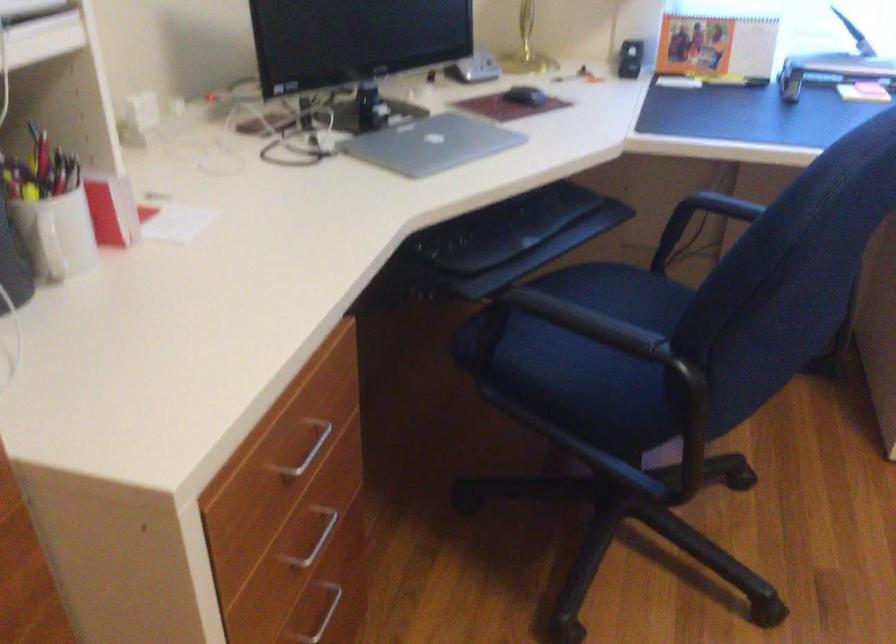
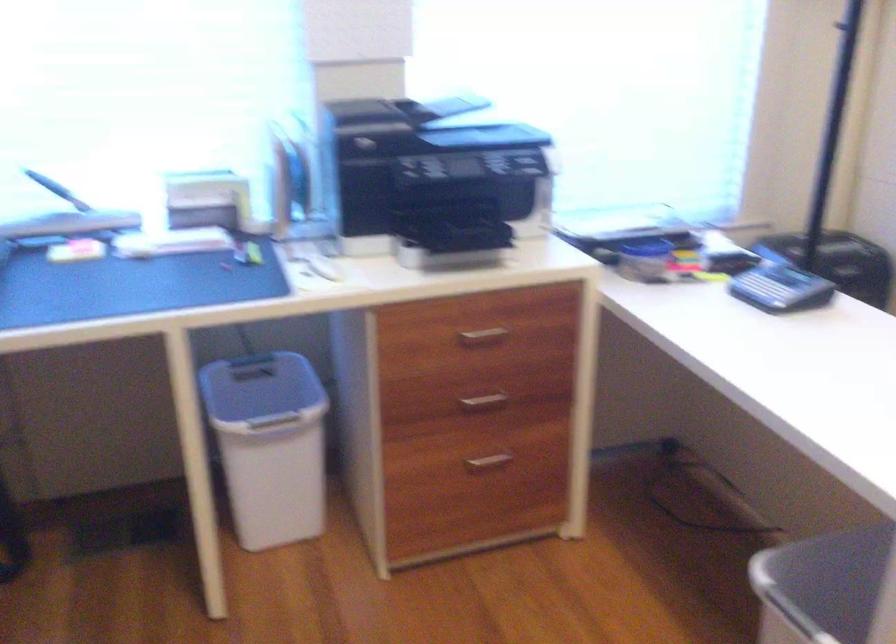
Question: The images are taken continuously from a first-person perspective. In which direction is your viewpoint rotating?

Choices:
 (A) Left
 (B) Right
 (C) Up
 (D) Down

Answer: (B)